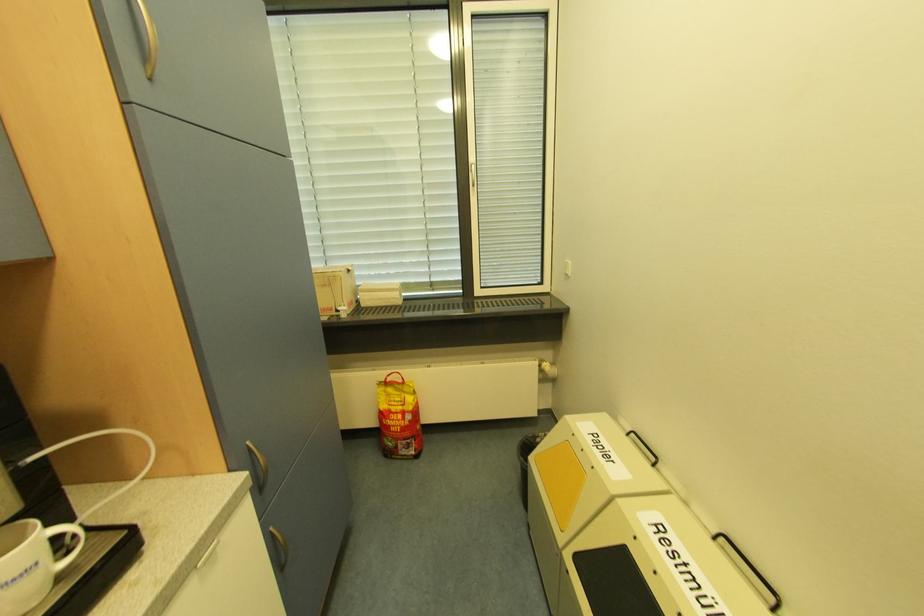
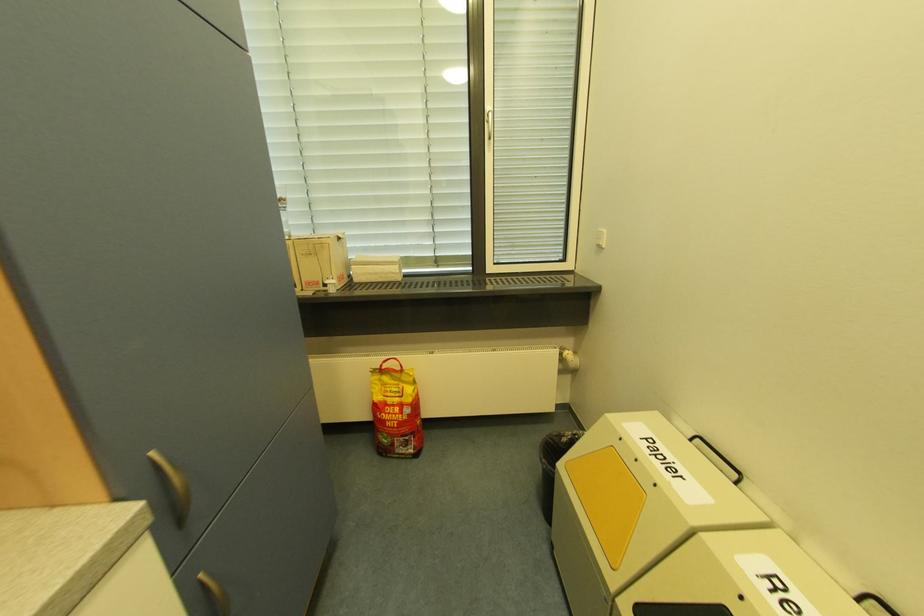
Question: How did the camera likely rotate?

Choices:
 (A) Left
 (B) Right
 (C) Up
 (D) Down

Answer: (D)